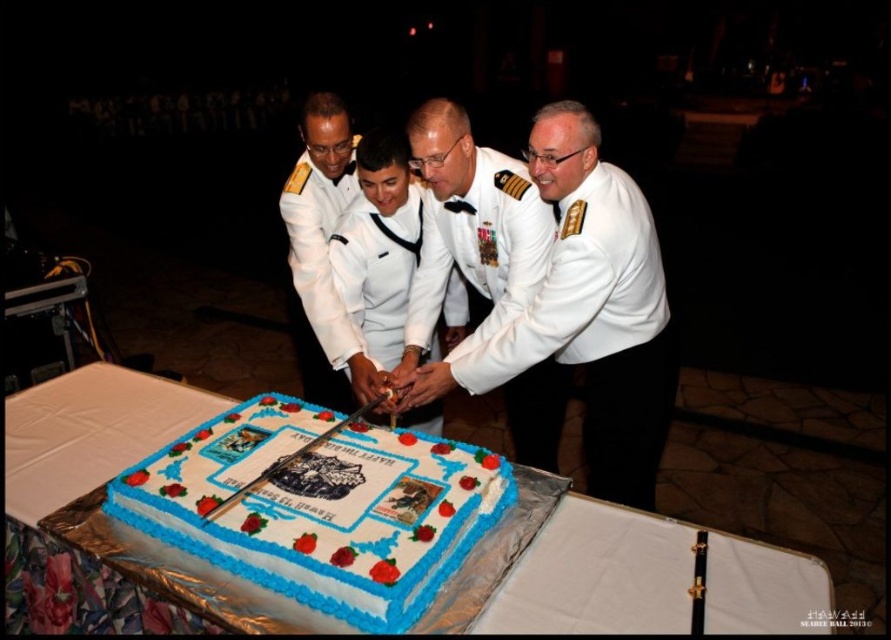
Can you confirm if white glossy uniform at center is positioned below white matte uniform at center?

Indeed, white glossy uniform at center is positioned under white matte uniform at center.

The height and width of the screenshot is (640, 891). What do you see at coordinates (599, 333) in the screenshot?
I see `white glossy uniform at center` at bounding box center [599, 333].

Where is `white glossy uniform at center`? Image resolution: width=891 pixels, height=640 pixels. white glossy uniform at center is located at coordinates (599, 333).

Can you confirm if white fondant cake at center is positioned to the left of white matte uniform at center?

Correct, you'll find white fondant cake at center to the left of white matte uniform at center.

Is white fondant cake at center closer to the viewer compared to white matte uniform at center?

Yes, it is.

Which is behind, point (354, 586) or point (391, 285)?

The point (391, 285) is more distant.

Where is `white fondant cake at center`? The width and height of the screenshot is (891, 640). white fondant cake at center is located at coordinates (320, 508).

Does point (609, 422) come closer to viewer compared to point (203, 481)?

No, it is behind (203, 481).

Consider the image. Can you confirm if white glossy cake at center is smaller than white fondant cake at center?

No.

Measure the distance between white glossy cake at center and camera.

white glossy cake at center is 1.89 meters from camera.

Locate an element on the screen. Image resolution: width=891 pixels, height=640 pixels. white glossy cake at center is located at coordinates (549, 298).